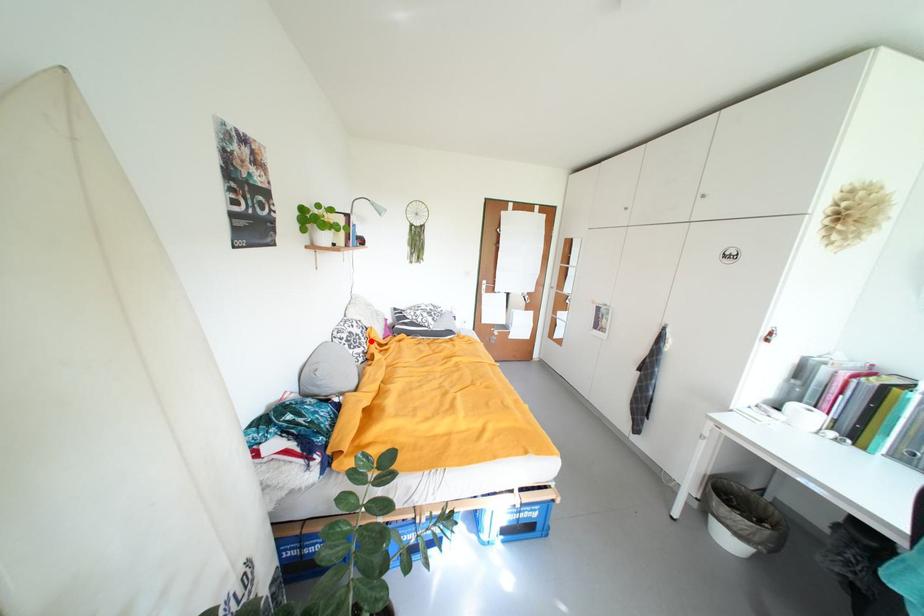
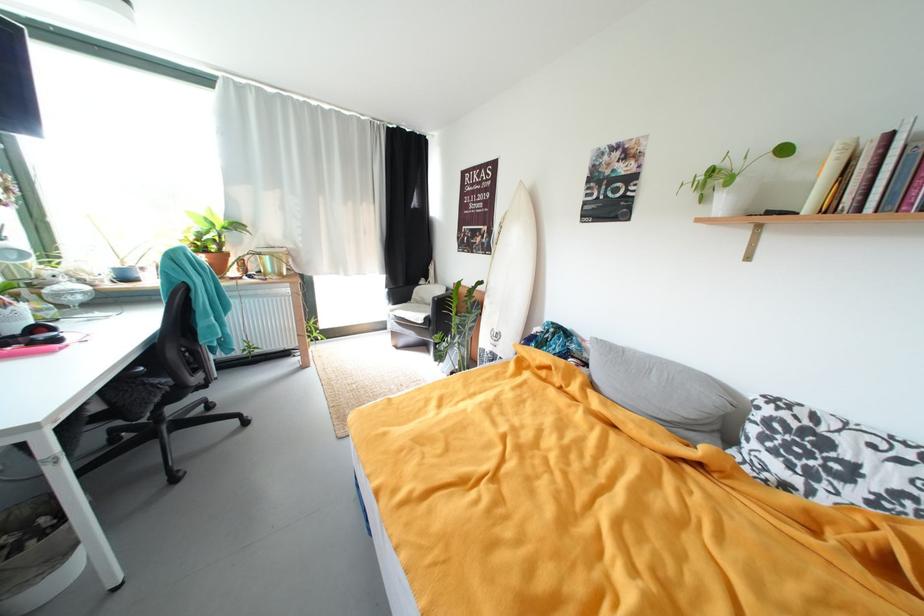
Question: I am providing you with two images of the same scene from different viewpoints. A red point is shown in image1. For the corresponding object point in image2, is it positioned nearer or farther from the camera?

Choices:
 (A) Nearer
 (B) Farther

Answer: (B)